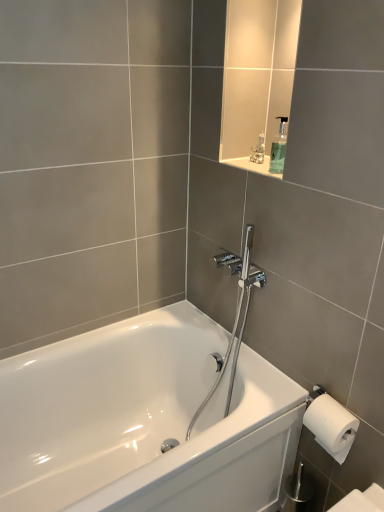
Question: Is polished chrome shower head at center at the back of white glossy bathtub at center?

Choices:
 (A) no
 (B) yes

Answer: (A)

Question: From a real-world perspective, is white glossy bathtub at center located higher than polished chrome shower head at center?

Choices:
 (A) yes
 (B) no

Answer: (B)

Question: From a real-world perspective, is white glossy bathtub at center physically below polished chrome shower head at center?

Choices:
 (A) yes
 (B) no

Answer: (A)

Question: Is white glossy bathtub at center aimed at polished chrome shower head at center?

Choices:
 (A) yes
 (B) no

Answer: (B)

Question: Is white glossy bathtub at center shorter than polished chrome shower head at center?

Choices:
 (A) yes
 (B) no

Answer: (A)

Question: From the image's perspective, is white glossy bathtub at center over polished chrome shower head at center?

Choices:
 (A) yes
 (B) no

Answer: (B)

Question: Would you say metallic silver figurine at upper center is outside white glossy bathtub at center?

Choices:
 (A) yes
 (B) no

Answer: (A)

Question: Would you say metallic silver figurine at upper center is a long distance from white glossy bathtub at center?

Choices:
 (A) no
 (B) yes

Answer: (A)

Question: Does metallic silver figurine at upper center have a lesser width compared to white glossy bathtub at center?

Choices:
 (A) no
 (B) yes

Answer: (B)

Question: From the image's perspective, would you say metallic silver figurine at upper center is shown under white glossy bathtub at center?

Choices:
 (A) yes
 (B) no

Answer: (B)

Question: Is metallic silver figurine at upper center further to camera compared to white glossy bathtub at center?

Choices:
 (A) yes
 (B) no

Answer: (A)

Question: Considering the relative sizes of metallic silver figurine at upper center and white glossy bathtub at center in the image provided, is metallic silver figurine at upper center taller than white glossy bathtub at center?

Choices:
 (A) yes
 (B) no

Answer: (B)

Question: Considering the relative sizes of metallic silver figurine at upper center and transparent plastic soap dispenser at upper center in the image provided, is metallic silver figurine at upper center shorter than transparent plastic soap dispenser at upper center?

Choices:
 (A) yes
 (B) no

Answer: (A)